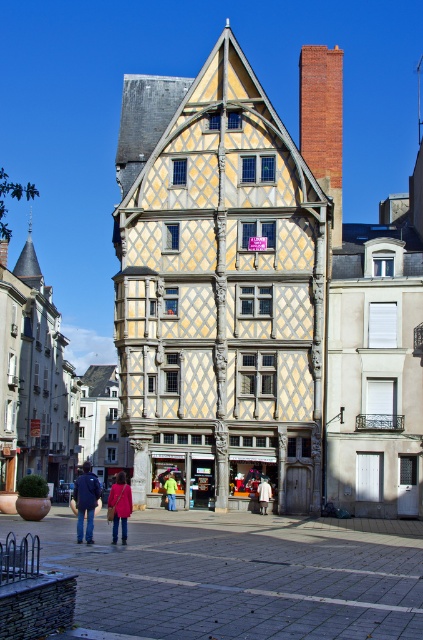
You are standing in front of the half timbered building and see a pink fabric coat at lower center. Where exactly is the point at (120, 506) located?

The point at (120, 506) is located on the pink fabric coat at lower center.

You are a photographer standing at the camera position. You want to take a closeup shot of the white cotton shirt at center. Can you reach it without moving from your current position?

The white cotton shirt at center is 61.09 meters from camera, so you cannot reach it without moving from your current position to take a closeup shot.